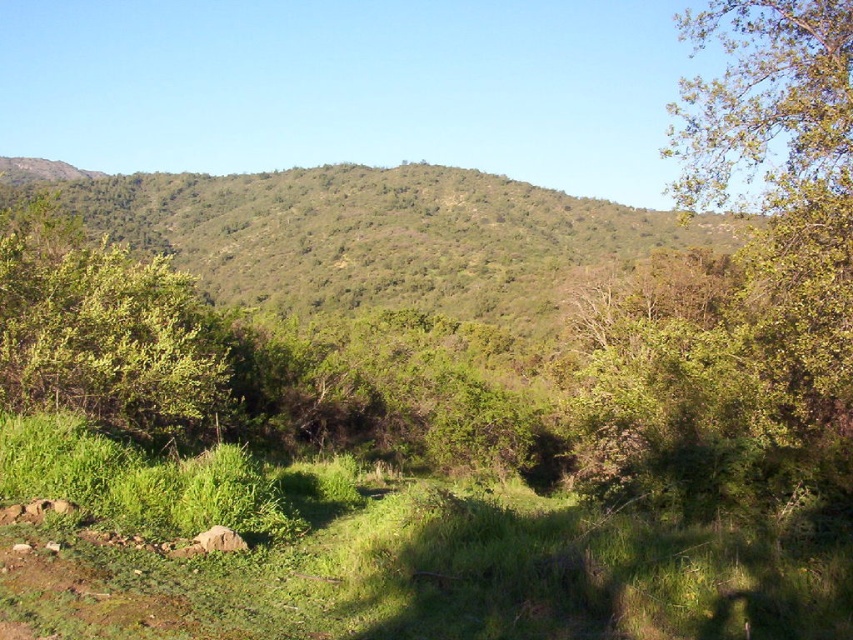
This screenshot has width=853, height=640. Describe the element at coordinates (374, 236) in the screenshot. I see `green leafy hillside at center` at that location.

Does green leafy hillside at center have a larger size compared to green leafy bush at left?

Indeed, green leafy hillside at center has a larger size compared to green leafy bush at left.

Image resolution: width=853 pixels, height=640 pixels. Describe the element at coordinates (374, 236) in the screenshot. I see `green leafy hillside at center` at that location.

Where is `green leafy hillside at center`? green leafy hillside at center is located at coordinates (374, 236).